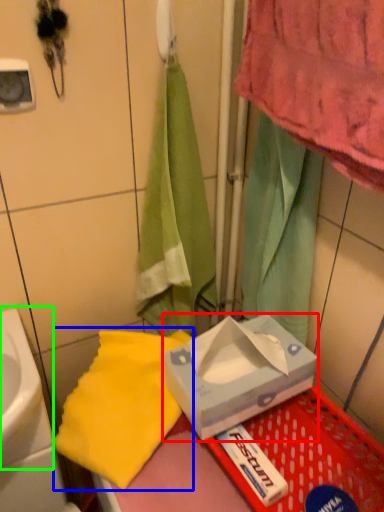
Question: Which object is positioned farthest from box (highlighted by a red box)? Select from beach towel (highlighted by a blue box) and sink (highlighted by a green box).

Choices:
 (A) beach towel
 (B) sink

Answer: (B)